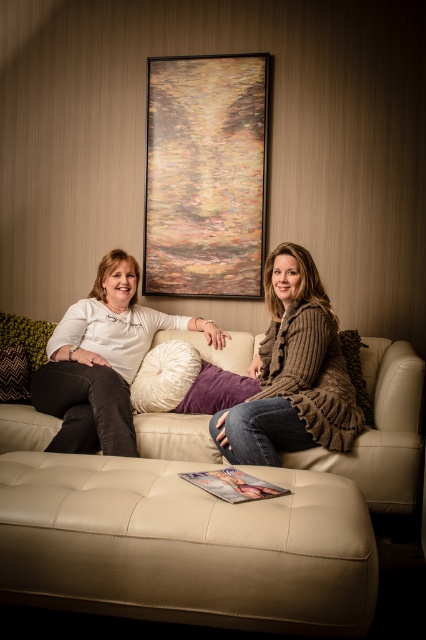
Question: Does knitted brown sweater at center appear on the right side of matte white shirt at center?

Choices:
 (A) yes
 (B) no

Answer: (A)

Question: Considering the real-world distances, which object is farthest from the leather ottoman at center?

Choices:
 (A) matte white shirt at center
 (B) beige leather couch at center
 (C) purple velvet pillow at center

Answer: (C)

Question: Is the position of beige leather couch at center less distant than that of white fluffy pillow at center?

Choices:
 (A) no
 (B) yes

Answer: (B)

Question: Does gold textured canvas at upper center appear on the right side of matte white shirt at center?

Choices:
 (A) yes
 (B) no

Answer: (A)

Question: Which of the following is the farthest from the observer?

Choices:
 (A) (169, 380)
 (B) (244, 216)
 (C) (291, 442)

Answer: (B)

Question: Which object is farther from the camera taking this photo?

Choices:
 (A) matte white shirt at center
 (B) purple velvet pillow at center

Answer: (B)